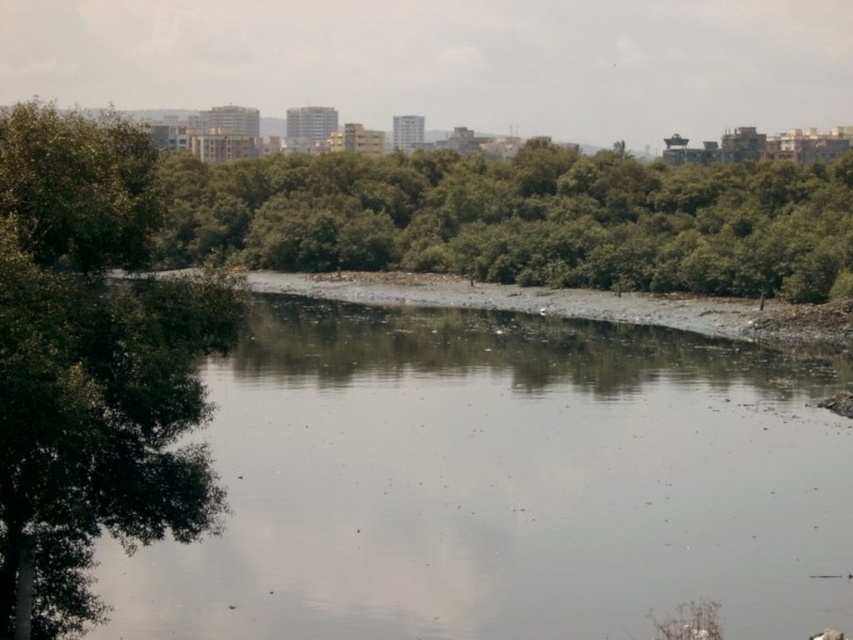
Question: Which of the following is the closest to the observer?

Choices:
 (A) green leafy tree at left
 (B) green leafy trees at center

Answer: (A)

Question: Is gray gravel river at center below green leafy tree at left?

Choices:
 (A) yes
 (B) no

Answer: (B)

Question: Is gray gravel river at center smaller than green leafy tree at left?

Choices:
 (A) no
 (B) yes

Answer: (A)

Question: Which point is farther to the camera?

Choices:
 (A) (45, 298)
 (B) (735, 220)

Answer: (B)

Question: Which object is the farthest from the green leafy tree at left?

Choices:
 (A) gray gravel river at center
 (B) green leafy trees at center

Answer: (B)

Question: Is gray gravel river at center thinner than green leafy tree at left?

Choices:
 (A) no
 (B) yes

Answer: (A)